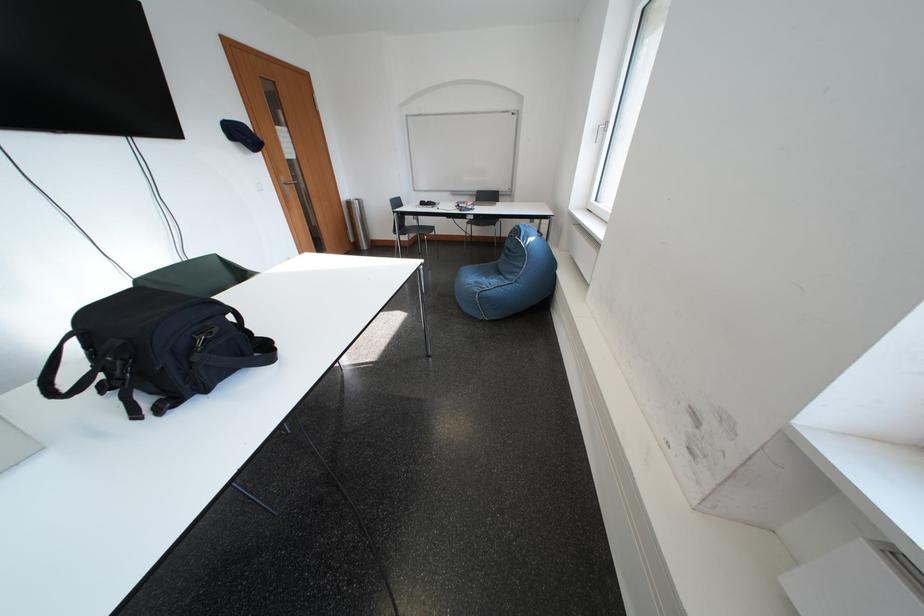
Where would you sitting on the chair sitting surface? Please return your answer as a coordinate pair (x, y).

(417, 229)